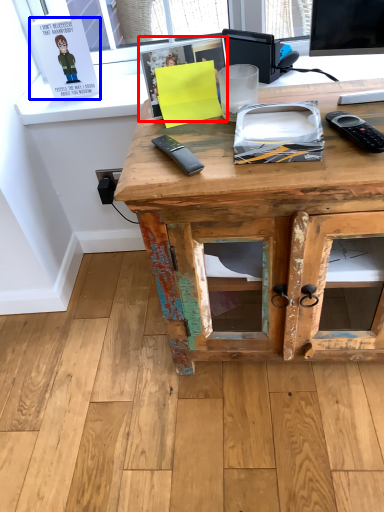
Question: Among these objects, which one is farthest to the camera, book (highlighted by a red box) or book (highlighted by a blue box)?

Choices:
 (A) book
 (B) book

Answer: (B)